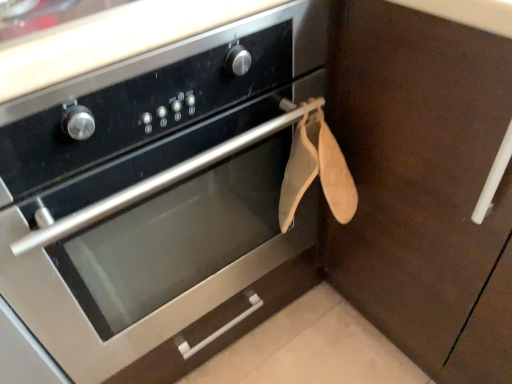
Question: Considering the relative sizes of satin black oven at center and brown matte cabinet at upper right in the image provided, is satin black oven at center smaller than brown matte cabinet at upper right?

Choices:
 (A) no
 (B) yes

Answer: (B)

Question: Does satin black oven at center turn towards brown matte cabinet at upper right?

Choices:
 (A) yes
 (B) no

Answer: (B)

Question: Does satin black oven at center have a greater width compared to brown matte cabinet at upper right?

Choices:
 (A) yes
 (B) no

Answer: (B)

Question: Is satin black oven at center not near brown matte cabinet at upper right?

Choices:
 (A) no
 (B) yes

Answer: (A)

Question: From a real-world perspective, is satin black oven at center physically below brown matte cabinet at upper right?

Choices:
 (A) yes
 (B) no

Answer: (B)

Question: Considering the relative sizes of satin black oven at center and brown matte cabinet at upper right in the image provided, is satin black oven at center taller than brown matte cabinet at upper right?

Choices:
 (A) no
 (B) yes

Answer: (B)

Question: Could you tell me if brown matte cabinet at upper right is facing satin black oven at center?

Choices:
 (A) no
 (B) yes

Answer: (B)

Question: Is brown matte cabinet at upper right taller than satin black oven at center?

Choices:
 (A) no
 (B) yes

Answer: (A)

Question: Is the position of brown matte cabinet at upper right less distant than that of satin black oven at center?

Choices:
 (A) yes
 (B) no

Answer: (B)

Question: Is brown matte cabinet at upper right beside satin black oven at center?

Choices:
 (A) yes
 (B) no

Answer: (B)

Question: Is brown matte cabinet at upper right not close to satin black oven at center?

Choices:
 (A) no
 (B) yes

Answer: (A)

Question: Is brown matte cabinet at upper right completely or partially outside of satin black oven at center?

Choices:
 (A) no
 (B) yes

Answer: (B)

Question: In the image, is brown matte cabinet at upper right positioned in front of or behind satin black oven at center?

Choices:
 (A) behind
 (B) front

Answer: (A)